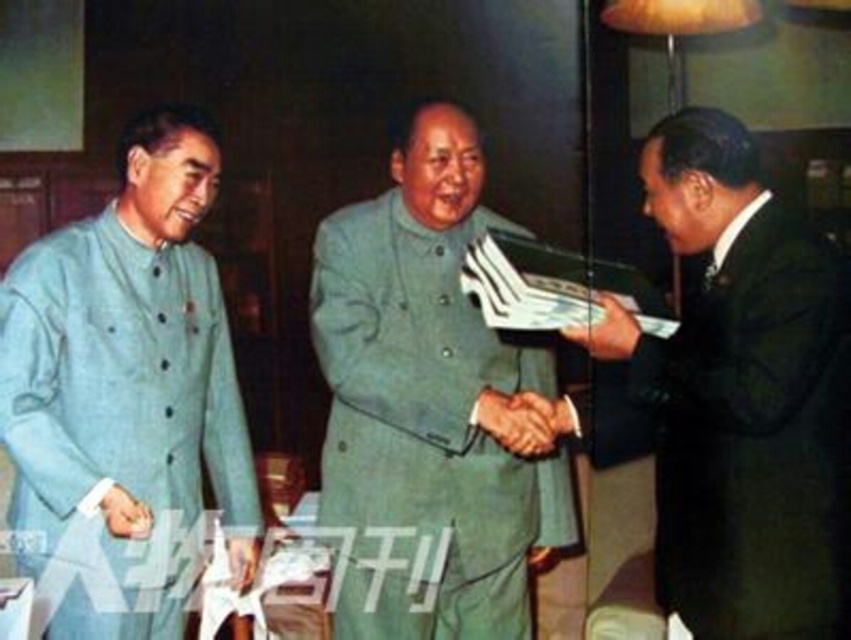
Question: Observing the image, what is the correct spatial positioning of green matte uniform at center in reference to smooth leather wallet at center?

Choices:
 (A) right
 (B) left

Answer: (B)

Question: Is light blue fabric jacket at left positioned at the back of smooth skin hand at center?

Choices:
 (A) yes
 (B) no

Answer: (B)

Question: Observing the image, what is the correct spatial positioning of dark green suit at right in reference to smooth leather wallet at center?

Choices:
 (A) below
 (B) above

Answer: (A)

Question: Which object is farther from the camera taking this photo?

Choices:
 (A) light blue fabric jacket at left
 (B) smooth skin hand at center
 (C) dark green suit at right

Answer: (B)

Question: Which point appears farthest from the camera in this image?

Choices:
 (A) (129, 144)
 (B) (677, 513)
 (C) (107, 516)

Answer: (A)

Question: Which of these objects is positioned closest to the smooth skin hand at center?

Choices:
 (A) green matte uniform at center
 (B) smooth leather wallet at center
 (C) light blue fabric jacket at left

Answer: (C)